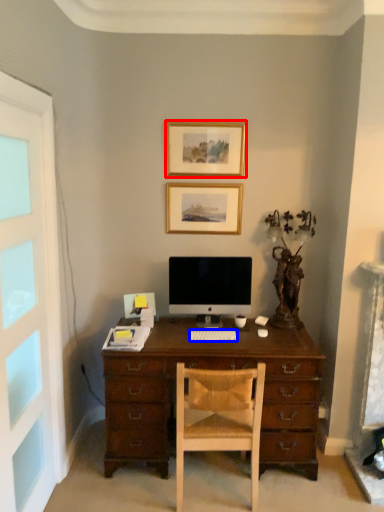
Question: Which point is further to the camera, picture frame (highlighted by a red box) or computer keyboard (highlighted by a blue box)?

Choices:
 (A) picture frame
 (B) computer keyboard

Answer: (A)